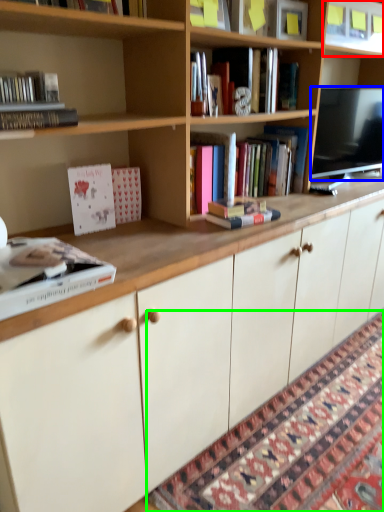
Question: Which object is the farthest from shelf (highlighted by a red box)? Choose among these: television (highlighted by a blue box) or mat (highlighted by a green box).

Choices:
 (A) television
 (B) mat

Answer: (B)